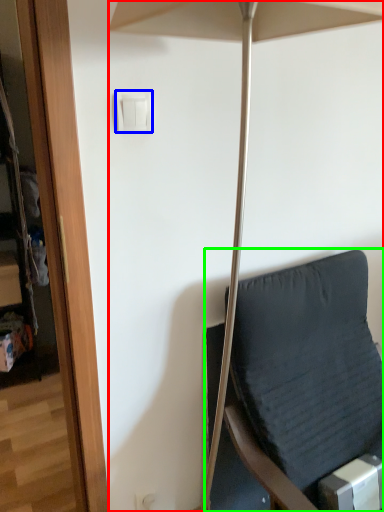
Question: Which object is the farthest from umbrella (highlighted by a red box)? Choose among these: light switch (highlighted by a blue box) or furniture (highlighted by a green box).

Choices:
 (A) light switch
 (B) furniture

Answer: (B)